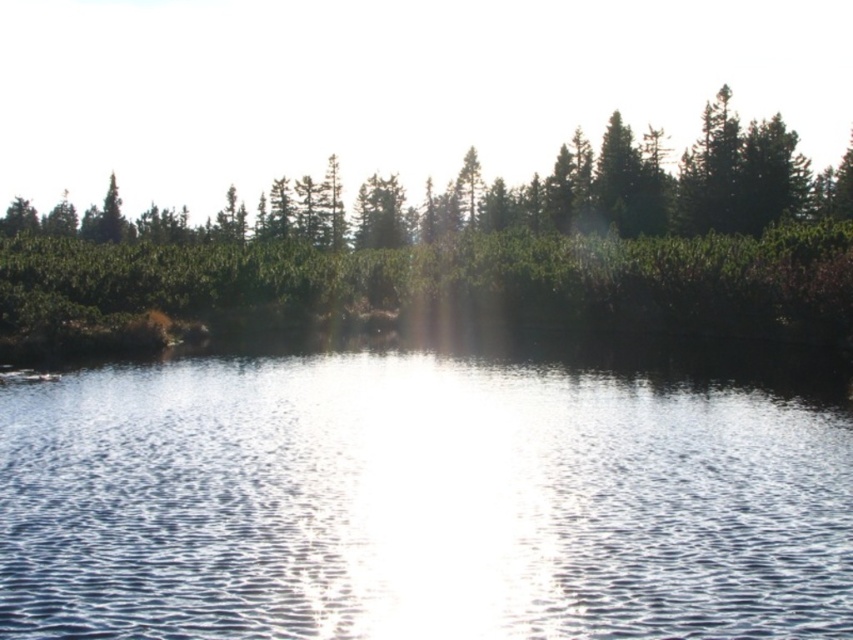
You are standing at the camera position and want to reach the point marked at coordinates (422,435). Given that you can walk at a speed of 3 meters per minute, how many minutes will it take you to reach that point?

The point marked at coordinates (422,435) is 24.60 meters away from the camera. At a walking speed of 3 meters per minute, it will take you 24.60 divided by 3, which equals approximately 8.2 minutes to reach that point.

You are standing at the point with coordinates point (x=303, y=276) and want to move towards the point with coordinates point (x=250, y=433). Given that you can only move forward in a straight line, will you be moving towards or away from the camera?

Since point (x=250, y=433) is closer to the camera than point (x=303, y=276), moving towards point (x=250, y=433) means you are moving closer to the camera.